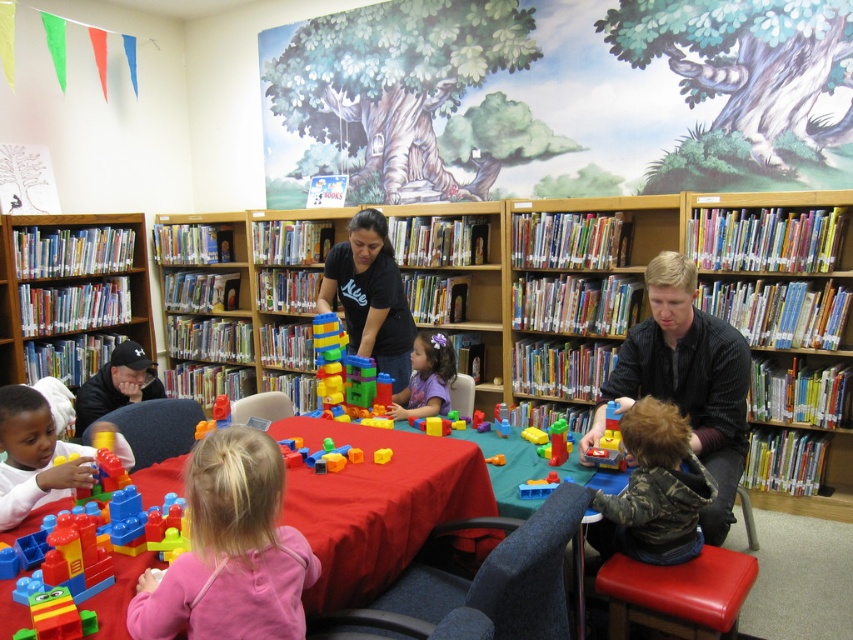
Which is behind, point (109, 595) or point (90, 483)?

The point (90, 483) is more distant.

I want to click on red fabric table at center, so coord(376,502).

Is point (622, 528) farther from viewer compared to point (4, 460)?

That is True.

Is camouflage fabric shirt at lower right smaller than matte plastic blocks at lower left?

Actually, camouflage fabric shirt at lower right might be larger than matte plastic blocks at lower left.

In the scene shown: Who is more forward, (682,544) or (70,481)?

Positioned in front is point (70,481).

The height and width of the screenshot is (640, 853). What are the coordinates of `camouflage fabric shirt at lower right` in the screenshot? It's located at (654, 490).

Based on the photo, who is taller, translucent plastic blocks at center or translucent plastic toy at center?

translucent plastic blocks at center is taller.

Does point (347, 397) lie behind point (606, 412)?

Yes, point (347, 397) is farther from viewer.

This screenshot has height=640, width=853. Identify the location of translucent plastic blocks at center. (338, 371).

Identify the location of translucent plastic blocks at center. The width and height of the screenshot is (853, 640). (338, 371).